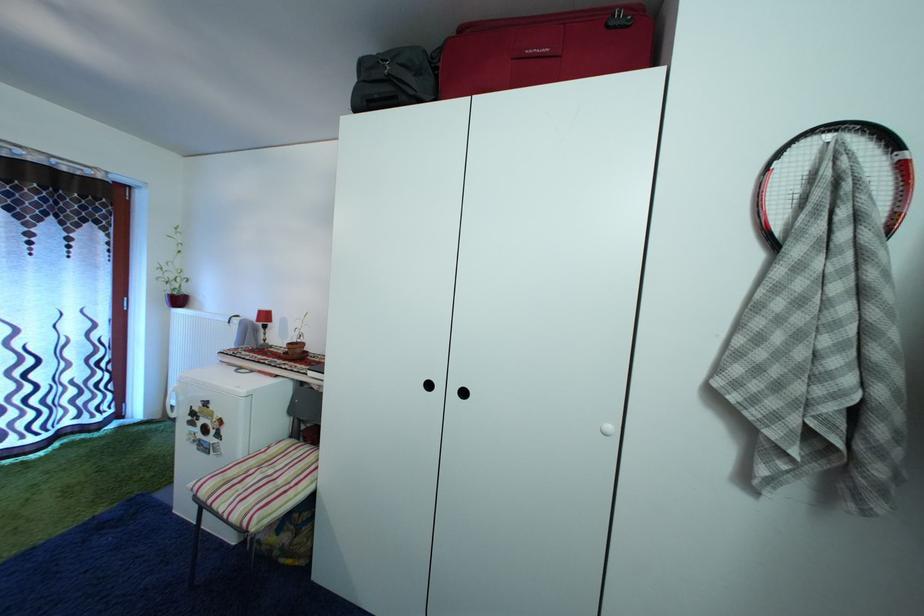
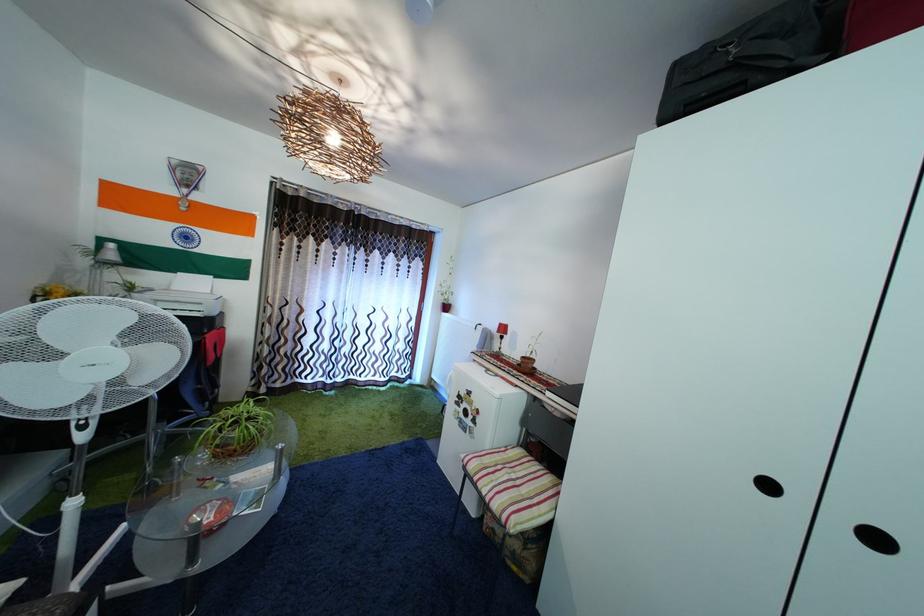
Locate, in the second image, the point that corresponds to (x=264, y=337) in the first image.

(500, 345)